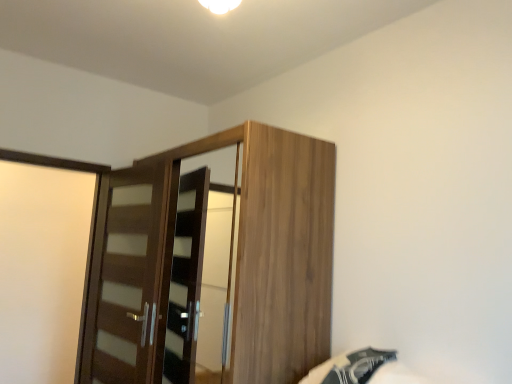
In order to click on black fabric bed at lower right in this screenshot , I will do `click(362, 369)`.

Describe the element at coordinates (123, 277) in the screenshot. The width and height of the screenshot is (512, 384). I see `brown wood door at left` at that location.

Find the location of a particular element. The width and height of the screenshot is (512, 384). wooden wardrobe at center is located at coordinates (236, 263).

Locate an element on the screen. This screenshot has height=384, width=512. black fabric bed at lower right is located at coordinates (362, 369).

Is black fabric bed at lower right bigger than brown wood door at left?

No.

Does black fabric bed at lower right contain brown wood door at left?

No, black fabric bed at lower right does not contain brown wood door at left.

Can you confirm if wooden wardrobe at center is bigger than black fabric bed at lower right?

Correct, wooden wardrobe at center is larger in size than black fabric bed at lower right.

From their relative heights in the image, would you say wooden wardrobe at center is taller or shorter than black fabric bed at lower right?

wooden wardrobe at center is taller than black fabric bed at lower right.

The height and width of the screenshot is (384, 512). What are the coordinates of `cupboard positioned vertically above the black fabric bed at lower right (from a real-world perspective)` in the screenshot? It's located at (236, 263).

From the image's perspective, is wooden wardrobe at center located beneath black fabric bed at lower right?

Incorrect, from the image's perspective, wooden wardrobe at center is higher than black fabric bed at lower right.

Between wooden wardrobe at center and brown wood door at left, which one has smaller width?

brown wood door at left.

From a real-world perspective, who is located higher, wooden wardrobe at center or brown wood door at left?

From a 3D spatial view, wooden wardrobe at center is above.

Is wooden wardrobe at center spatially inside brown wood door at left, or outside of it?

wooden wardrobe at center is spatially situated outside brown wood door at left.

How different are the orientations of wooden wardrobe at center and brown wood door at left in degrees?

→ They differ by 1.16 degrees in their facing directions.

Is black fabric bed at lower right positioned behind wooden wardrobe at center?

That is False.

Would you say black fabric bed at lower right is inside or outside wooden wardrobe at center?

black fabric bed at lower right is outside wooden wardrobe at center.

From a real-world perspective, is black fabric bed at lower right located beneath wooden wardrobe at center?

Yes, from a real-world perspective, black fabric bed at lower right is under wooden wardrobe at center.

Would you say brown wood door at left is a long distance from black fabric bed at lower right?

Absolutely, brown wood door at left is distant from black fabric bed at lower right.

Would you say brown wood door at left is outside black fabric bed at lower right?

Yes, brown wood door at left is located beyond the bounds of black fabric bed at lower right.

Is brown wood door at left at the left side of black fabric bed at lower right?

Correct, you'll find brown wood door at left to the left of black fabric bed at lower right.

Does brown wood door at left have a lesser width compared to wooden wardrobe at center?

Indeed, brown wood door at left has a lesser width compared to wooden wardrobe at center.

Is brown wood door at left not inside wooden wardrobe at center?

Indeed, brown wood door at left is completely outside wooden wardrobe at center.

Is brown wood door at left in front of or behind wooden wardrobe at center in the image?

In the image, brown wood door at left appears behind wooden wardrobe at center.

What's the angular difference between brown wood door at left and wooden wardrobe at center's facing directions?

1.16 degrees.

At what (x,y) coordinates should I click in order to perform the action: click on door that is above the black fabric bed at lower right (from the image's perspective). Please return your answer as a coordinate pair (x, y). The height and width of the screenshot is (384, 512). Looking at the image, I should click on coord(123,277).

The height and width of the screenshot is (384, 512). What are the coordinates of `bed in front of the wooden wardrobe at center` in the screenshot? It's located at (362, 369).

Estimate the real-world distances between objects in this image. Which object is closer to wooden wardrobe at center, black fabric bed at lower right or brown wood door at left?

Among the two, brown wood door at left is located nearer to wooden wardrobe at center.

Looking at the image, which one is located further to black fabric bed at lower right, brown wood door at left or wooden wardrobe at center?

The object further to black fabric bed at lower right is brown wood door at left.

Looking at the image, which one is located closer to brown wood door at left, black fabric bed at lower right or wooden wardrobe at center?

wooden wardrobe at center is positioned closer to the anchor brown wood door at left.

Estimate the real-world distances between objects in this image. Which object is further from wooden wardrobe at center, brown wood door at left or black fabric bed at lower right?

black fabric bed at lower right is positioned further to the anchor wooden wardrobe at center.

Estimate the real-world distances between objects in this image. Which object is closer to brown wood door at left, wooden wardrobe at center or black fabric bed at lower right?

The object closer to brown wood door at left is wooden wardrobe at center.

From the picture: When comparing their distances from black fabric bed at lower right, does wooden wardrobe at center or brown wood door at left seem closer?

Based on the image, wooden wardrobe at center appears to be nearer to black fabric bed at lower right.

Image resolution: width=512 pixels, height=384 pixels. Find the location of `cupboard located between brown wood door at left and black fabric bed at lower right in the left-right direction`. cupboard located between brown wood door at left and black fabric bed at lower right in the left-right direction is located at coordinates (236, 263).